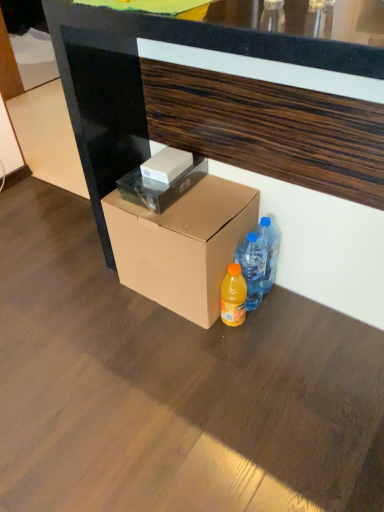
Question: In the image, is brown wood desk at center on the left side or the right side of blue translucent water bottles at lower right, which is the second bottle in left-to-right order?

Choices:
 (A) left
 (B) right

Answer: (B)

Question: From the image's perspective, relative to blue translucent water bottles at lower right, which is the second bottle in left-to-right order, is brown wood desk at center above or below?

Choices:
 (A) below
 (B) above

Answer: (B)

Question: Estimate the real-world distances between objects in this image. Which object is closer to the white glossy box at center, marked as the second box in a top-to-bottom arrangement?

Choices:
 (A) translucent plastic bottle at lower right, which is the 1th bottle from left to right
 (B) brown cardboard box at lower center, the 3th box from the top
 (C) brown wood desk at center
 (D) white matte box at center, acting as the first box starting from the top
 (E) blue translucent water bottles at lower right, which is the second bottle in left-to-right order

Answer: (D)

Question: Estimate the real-world distances between objects in this image. Which object is farther from the blue translucent water bottles at lower right, which is the 1th bottle from right to left?

Choices:
 (A) white glossy box at center, marked as the second box in a top-to-bottom arrangement
 (B) translucent plastic bottle at lower right, which is the 1th bottle from left to right
 (C) brown cardboard box at lower center, the first box ordered from the bottom
 (D) brown wood desk at center
 (E) white matte box at center, acting as the first box starting from the top

Answer: (D)